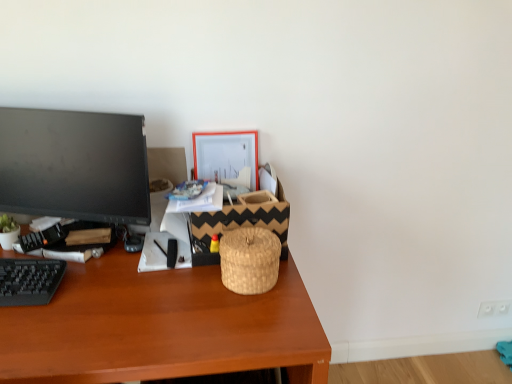
Question: Considering the relative positions of brown wooden desk at center and black glossy monitor at left in the image provided, is brown wooden desk at center to the left or to the right of black glossy monitor at left?

Choices:
 (A) right
 (B) left

Answer: (A)

Question: From a real-world perspective, is brown wooden desk at center above or below black glossy monitor at left?

Choices:
 (A) above
 (B) below

Answer: (B)

Question: Estimate the real-world distances between objects in this image. Which object is farther from the orange matte picture frame at upper center?

Choices:
 (A) black plastic keyboard at lower left
 (B) black glossy monitor at left
 (C) brown wooden desk at center
 (D) woven straw basket at center, which is the second basket in front-to-back order
 (E) woven natural basket at center, the first basket in the front-to-back sequence

Answer: (A)

Question: Considering the real-world distances, which object is farthest from the orange matte picture frame at upper center?

Choices:
 (A) black glossy monitor at left
 (B) brown wooden desk at center
 (C) black plastic keyboard at lower left
 (D) woven natural basket at center, the second basket from the back
 (E) woven straw basket at center, marked as the 1th basket in a back-to-front arrangement

Answer: (C)